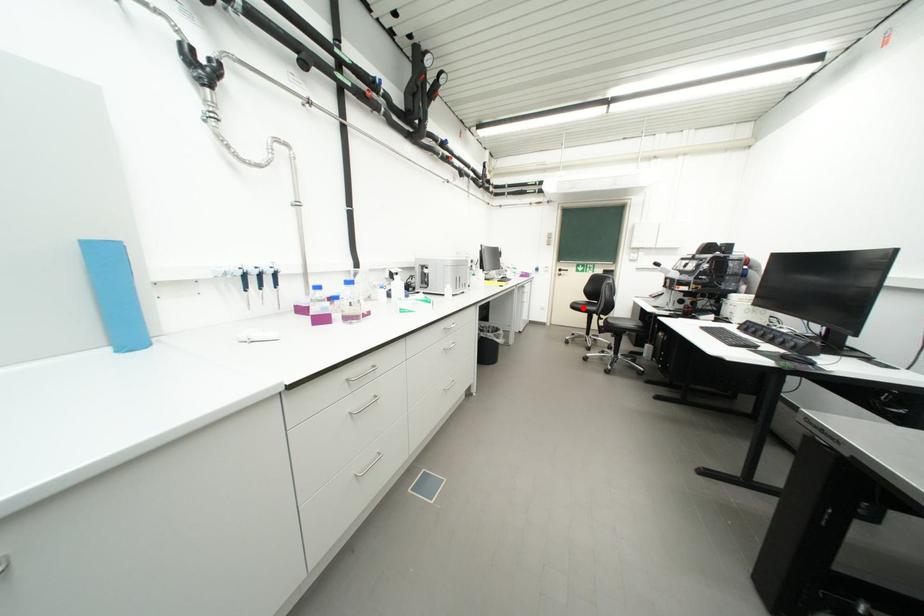
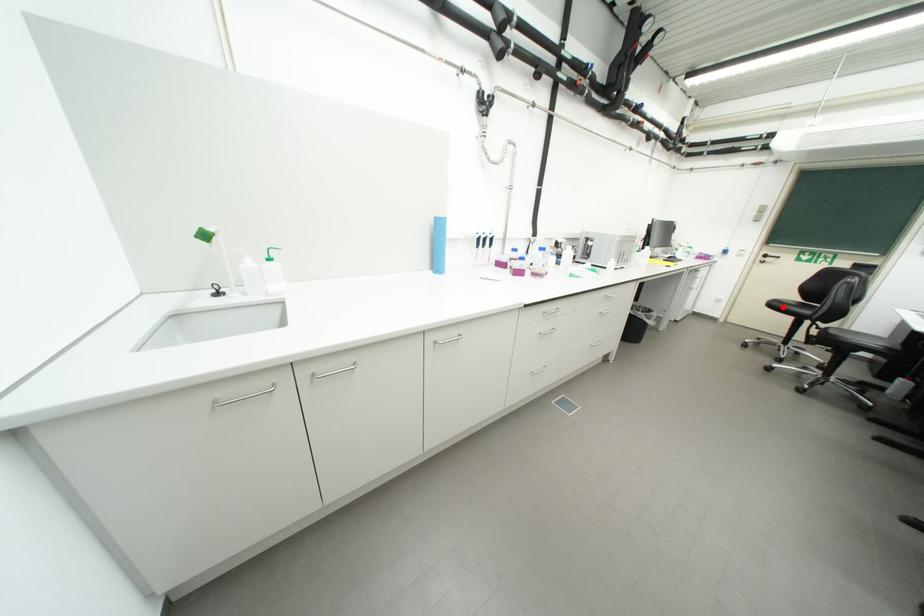
I am providing you with two images of the same scene from different viewpoints. A red point is marked on the first image and another point is marked on the second image. Is the marked point in image1 the same physical position as the marked point in image2?

Yes